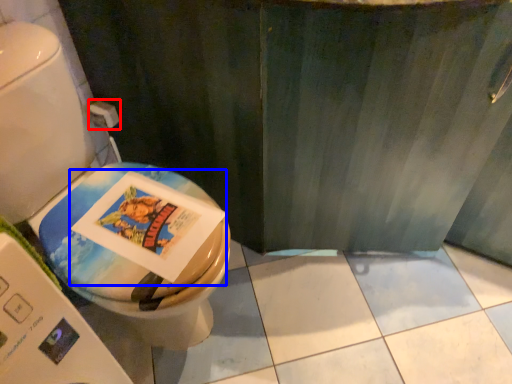
Question: Which object appears closest to the camera in this image, toilet paper (highlighted by a red box) or comic book (highlighted by a blue box)?

Choices:
 (A) toilet paper
 (B) comic book

Answer: (B)